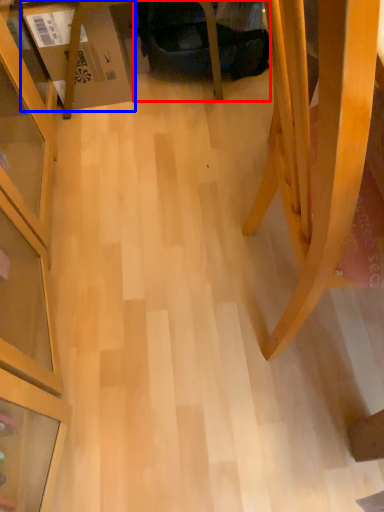
Question: Which of the following is the closest to the observer, swivel chair (highlighted by a red box) or cardboard box (highlighted by a blue box)?

Choices:
 (A) swivel chair
 (B) cardboard box

Answer: (B)